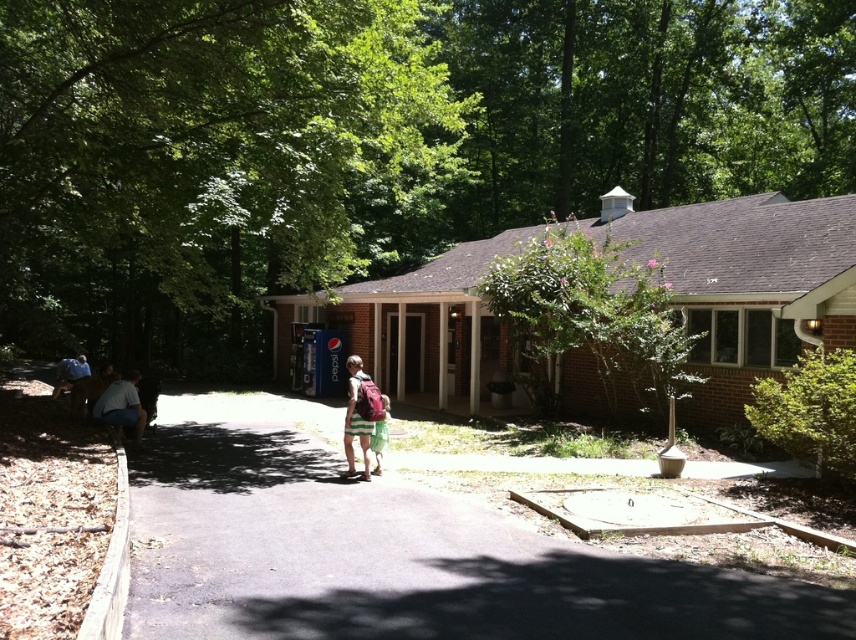
You are standing at the entrance of the brick building and want to walk to the dark asphalt pavement at center. Which direction should you head?

The dark asphalt pavement at center is located at point 0.867 on the x and 0.461 on the y coordinate, so you should head towards the center of the image to reach it.

You are planning to place a new bench in this outdoor area. The bench you have is the size of the denim shorts at lower left. Is there enough space to place the bench next to the brick gazebo at center without overlapping it?

The brick gazebo at center is bigger than the denim shorts at lower left. Since the bench is the size of the denim shorts at lower left, there should be sufficient space to place it next to the brick gazebo at center without overlapping, as the gazebo is larger and likely has enough surrounding area.

You are a delivery person trying to place a large package on the ground near the entrance. The package is too heavy to lift, so you need to slide it along the ground. Which object, the dark asphalt pavement at center or the denim shorts at lower left, would provide a smoother surface for sliding the package?

The dark asphalt pavement at center would provide a smoother surface for sliding the package since it is a paved surface, unlike the denim shorts at lower left which are likely rougher and smaller in size.